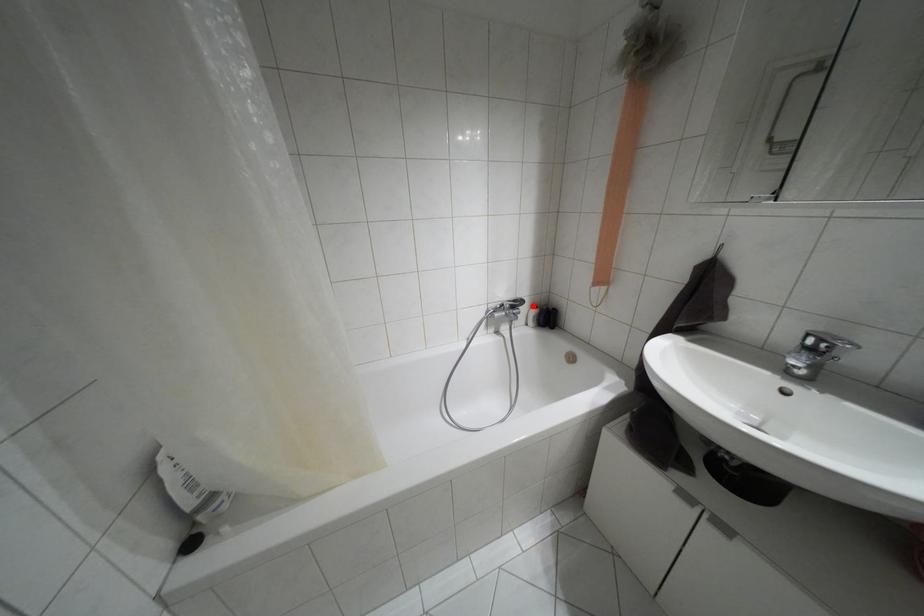
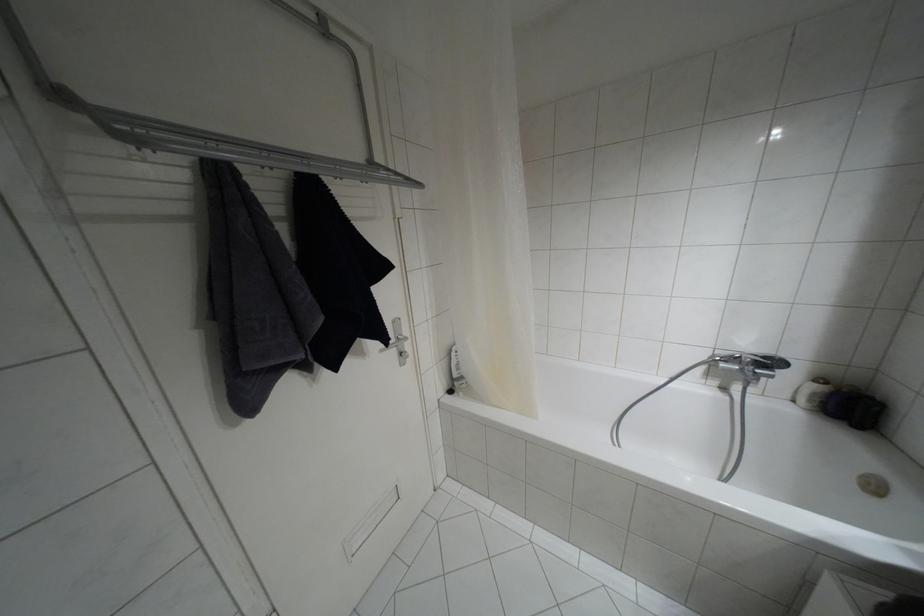
Find the pixel in the second image that matches the highlighted location in the first image.

(820, 379)